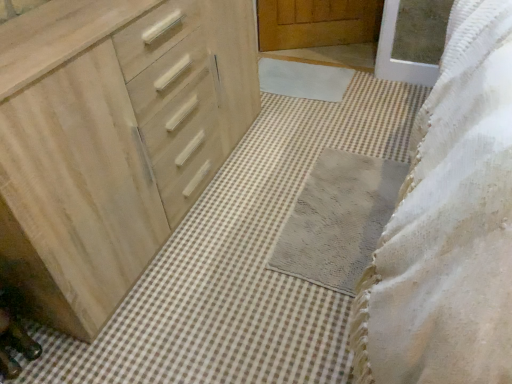
Question: From a real-world perspective, is white soft bath mat at center, arranged as the 1th bath mat when viewed from the top, positioned above or below gray textured bath mat at center, the 1th bath mat when ordered from bottom to top?

Choices:
 (A) below
 (B) above

Answer: (B)

Question: From the image's perspective, is white soft bath mat at center, arranged as the 1th bath mat when viewed from the top, positioned above or below gray textured bath mat at center, which ranks as the 2th bath mat in top-to-bottom order?

Choices:
 (A) below
 (B) above

Answer: (B)

Question: Estimate the real-world distances between objects in this image. Which object is farther from the gray textured bath mat at center, the 1th bath mat when ordered from bottom to top?

Choices:
 (A) natural wood chest of drawers at left
 (B) white soft bath mat at center, arranged as the 1th bath mat when viewed from the top

Answer: (B)

Question: Which object is the closest to the white soft bath mat at center, marked as the 2th bath mat in a front-to-back arrangement?

Choices:
 (A) gray textured bath mat at center, the 1th bath mat when ordered from bottom to top
 (B) natural wood chest of drawers at left

Answer: (A)